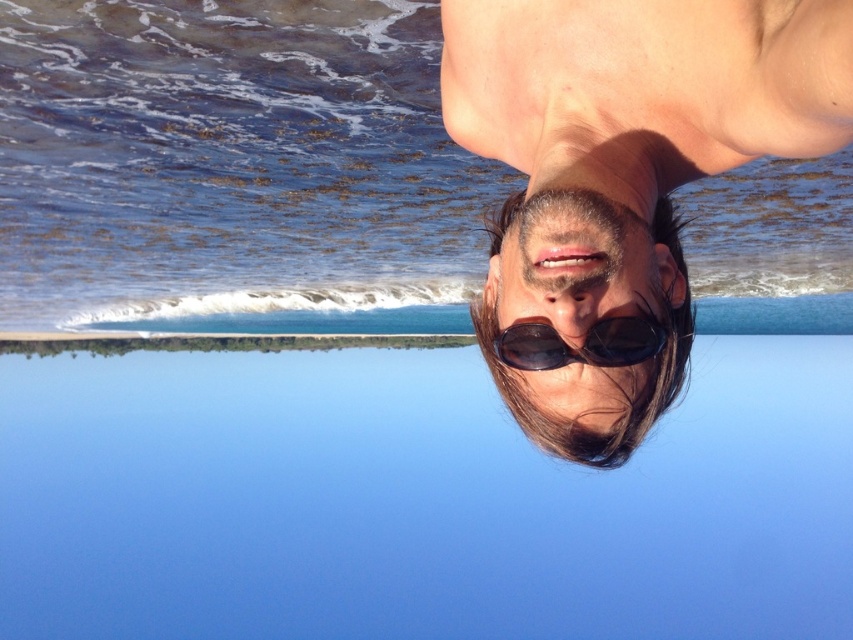
Based on the photo, you are a photographer analyzing the rotated beach image. You notice two sunglasses in the scene. According to the rotated image, which of the two sunglasses, the matte black sunglasses at upper right or the sunglasses at center, is positioned higher up in the image?

The matte black sunglasses at upper right is positioned higher up in the image than the sunglasses at center.

You are a photographer analyzing the rotated beach image. You need to determine if the clear blue water at upper center is positioned higher up in the image compared to the black reflective sunglasses at bottom. Can you confirm this?

The clear blue water at upper center is taller than the black reflective sunglasses at bottom, so yes, the clear blue water at upper center is positioned higher up in the image compared to the black reflective sunglasses at bottom.

You are a photographer trying to capture the perfect shot of the beach scene. You notice two points marked in the image at coordinates point (834, 243) and point (624, 300). Based on their positions, which point is closer to your camera lens?

Point (624, 300) is closer to the camera lens because it is positioned closer to the viewer than point (834, 243).